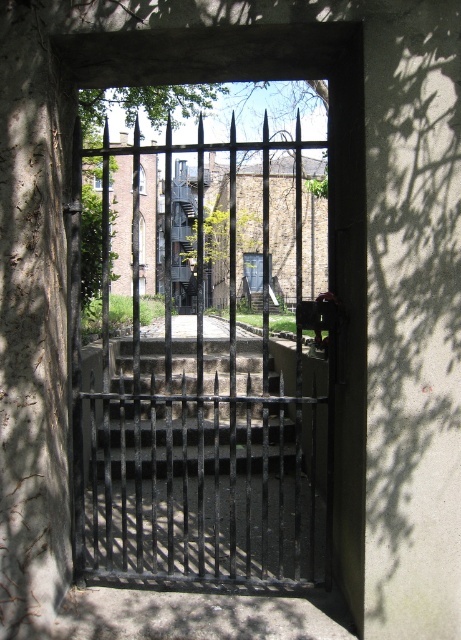
You are standing in front of the gate and want to determine the relative positions of two points marked on the gate. The first point is at coordinate point (x=240, y=256) and the second is at point (x=87, y=125). Which point is closer to you?

Point (x=87, y=125) is closer to you because it is less further to the camera than point (x=240, y=256).

You are standing outside the gate and want to enter the building. You notice a green leafy tree at upper center and a metallic gray staircase at center. Which object is positioned higher in the scene?

The green leafy tree at upper center is located above the metallic gray staircase at center, so it is positioned higher in the scene.